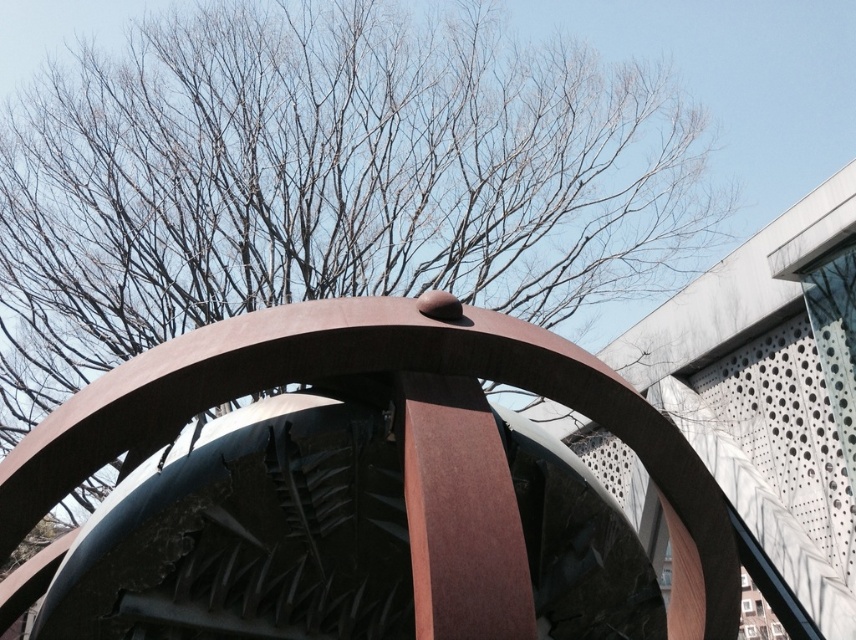
Based on the photo, is brown leafless tree at upper center to the right of rusty metal sculpture at center from the viewer's perspective?

In fact, brown leafless tree at upper center is to the left of rusty metal sculpture at center.

Is brown leafless tree at upper center to the left of rusty metal sculpture at center from the viewer's perspective?

Indeed, brown leafless tree at upper center is positioned on the left side of rusty metal sculpture at center.

Between point (627, 285) and point (498, 368), which one is positioned behind?

Point (627, 285)

Identify the location of brown leafless tree at upper center. The height and width of the screenshot is (640, 856). (325, 180).